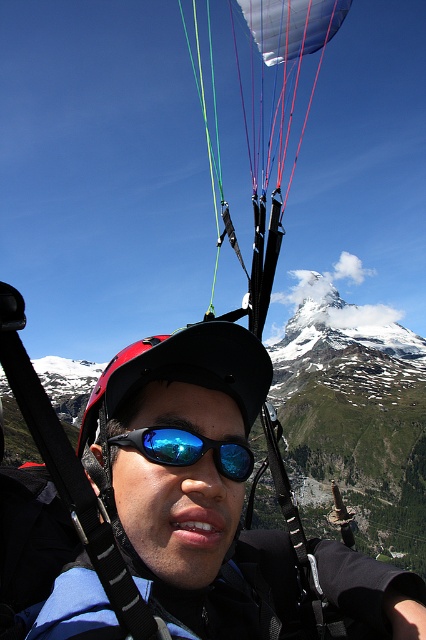
You are a pilot trying to locate your matte black helmet at center during flight. Based on the coordinates provided, can you confirm its exact position?

The matte black helmet at center is located at coordinates point (181, 467).

You are a photographer capturing the paraglider scene. You want to ensure both the matte black helmet at center and the matte black parachute at center are clearly visible in your shot. Based on their sizes, which object should you focus on first to ensure it doesn

The matte black helmet at center has a lesser width compared to the matte black parachute at center, so you should focus on the matte black parachute at center first since it is larger and will require more attention to capture details properly.

You are a safety inspector reviewing the paraglider setup. You notice the matte black helmet at center and the blue reflective lens goggles at center. According to safety regulations, the goggles must be positioned above the helmet to ensure proper visibility. Is the current arrangement compliant with these requirements?

The matte black helmet at center is positioned under blue reflective lens goggles at center, which means the goggles are above the helmet. This arrangement complies with safety regulations requiring goggles to be above the helmet for proper visibility.